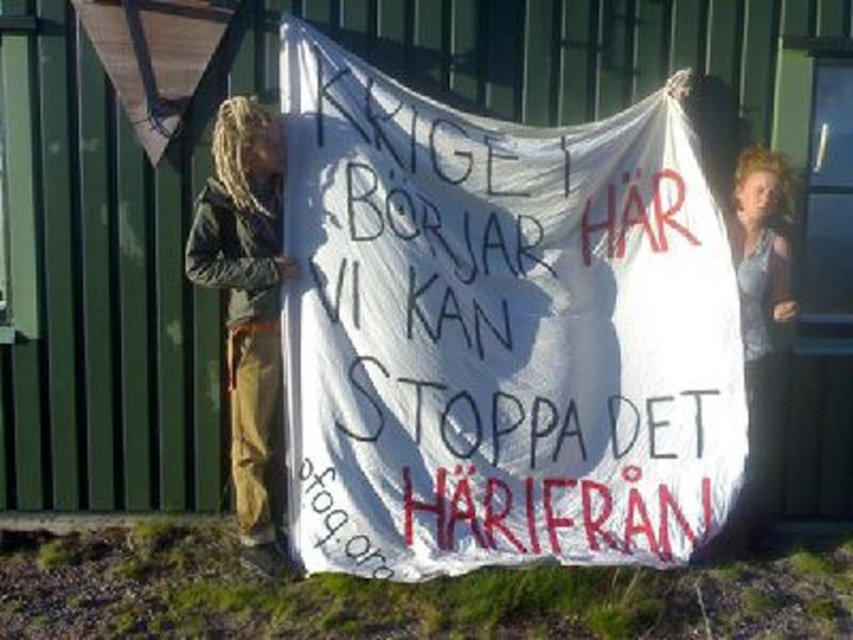
Does white paper banner at center have a larger size compared to brown leather jacket at left?

Indeed, white paper banner at center has a larger size compared to brown leather jacket at left.

Is point (521, 125) less distant than point (242, 480)?

No, (521, 125) is further to viewer.

What are the coordinates of `white paper banner at center` in the screenshot? It's located at (498, 332).

Find the location of a particular element. This screenshot has width=853, height=640. white paper banner at center is located at coordinates (498, 332).

Which is above, white paper banner at center or blonde hair at upper right?

white paper banner at center is higher up.

Where is `white paper banner at center`? white paper banner at center is located at coordinates (498, 332).

This screenshot has width=853, height=640. What do you see at coordinates (247, 304) in the screenshot?
I see `brown leather jacket at left` at bounding box center [247, 304].

Does brown leather jacket at left have a larger size compared to blonde hair at upper right?

Correct, brown leather jacket at left is larger in size than blonde hair at upper right.

You are a GUI agent. You are given a task and a screenshot of the screen. Output one action in this format:
    pyautogui.click(x=<x>, y=<y>)
    Task: Click on the brown leather jacket at left
    The image size is (853, 640).
    Given the screenshot: What is the action you would take?
    pyautogui.click(x=247, y=304)